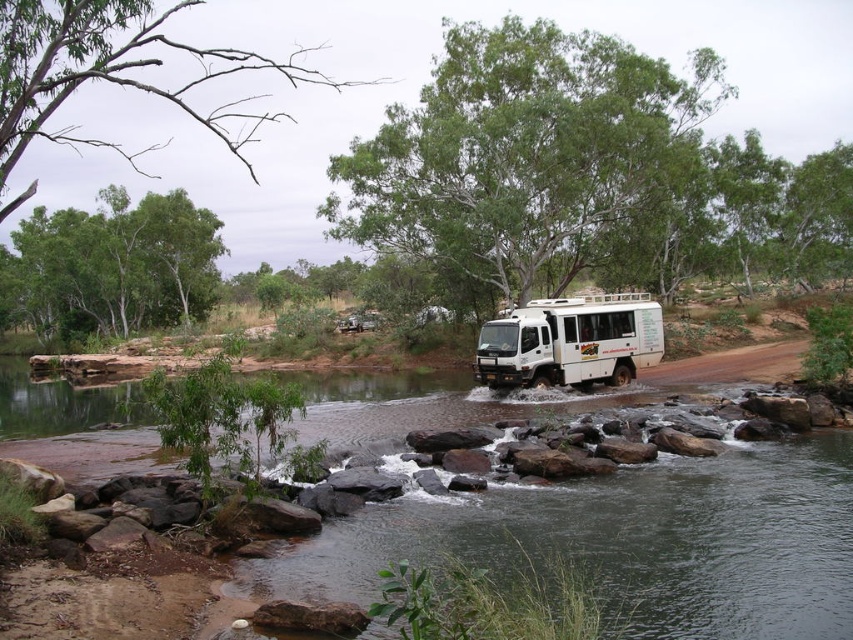
You are standing at the point closer to the camera in the image. Which point are you at, point (85,8) or point (207,256)?

You are at point (85,8) because it is closer to the camera than point (207,256).

You are standing at point (526, 154) in the image. What can you see directly in front of you?

You can see a green leafy tree at center directly in front of you at point (526, 154).